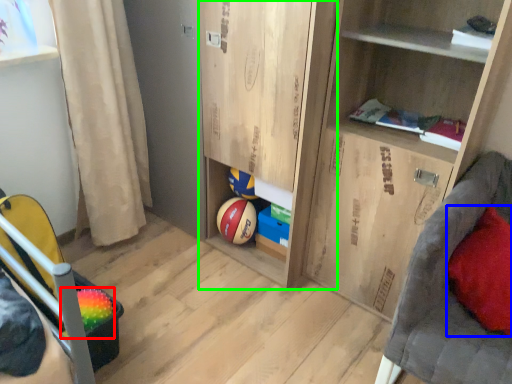
Question: Which object is the farthest from basketball (highlighted by a red box)? Choose among these: pillow (highlighted by a blue box) or cabinet (highlighted by a green box).

Choices:
 (A) pillow
 (B) cabinet

Answer: (A)